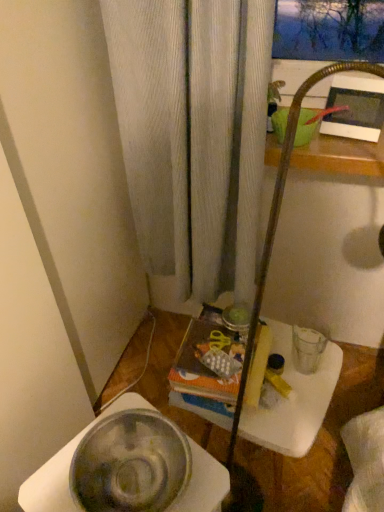
Question: Is green matte basin at upper right, which ranks as the 1th basin in back-to-front order, oriented away from clear plastic table at center?

Choices:
 (A) no
 (B) yes

Answer: (A)

Question: Could you tell me if green matte basin at upper right, the first basin from the right, is facing clear plastic table at center?

Choices:
 (A) yes
 (B) no

Answer: (B)

Question: Does green matte basin at upper right, which ranks as the 2th basin in front-to-back order, have a lesser height compared to clear plastic table at center?

Choices:
 (A) no
 (B) yes

Answer: (B)

Question: From the image's perspective, is green matte basin at upper right, placed as the 1th basin when sorted from top to bottom, over clear plastic table at center?

Choices:
 (A) yes
 (B) no

Answer: (A)

Question: Does green matte basin at upper right, which ranks as the 2th basin in front-to-back order, appear on the right side of clear plastic table at center?

Choices:
 (A) yes
 (B) no

Answer: (A)

Question: Is green matte basin at upper right, acting as the second basin starting from the bottom, taller than clear plastic table at center?

Choices:
 (A) yes
 (B) no

Answer: (B)

Question: Is clear plastic table at center behind metallic silver bowl at lower left, the 1th basin viewed from the left?

Choices:
 (A) yes
 (B) no

Answer: (A)

Question: Can you confirm if clear plastic table at center is shorter than metallic silver bowl at lower left, acting as the 1th basin starting from the front?

Choices:
 (A) yes
 (B) no

Answer: (B)

Question: Would you say clear plastic table at center is outside metallic silver bowl at lower left, which is the first basin from bottom to top?

Choices:
 (A) yes
 (B) no

Answer: (A)

Question: Considering the relative sizes of clear plastic table at center and metallic silver bowl at lower left, which appears as the 2th basin when viewed from the right, in the image provided, is clear plastic table at center bigger than metallic silver bowl at lower left, which appears as the 2th basin when viewed from the right,?

Choices:
 (A) yes
 (B) no

Answer: (A)

Question: Considering the relative positions of clear plastic table at center and metallic silver bowl at lower left, which is the 2th basin in back-to-front order, in the image provided, is clear plastic table at center to the left of metallic silver bowl at lower left, which is the 2th basin in back-to-front order, from the viewer's perspective?

Choices:
 (A) yes
 (B) no

Answer: (B)

Question: Is clear plastic table at center facing away from metallic silver bowl at lower left, which is the first basin from bottom to top?

Choices:
 (A) no
 (B) yes

Answer: (A)

Question: Could green matte basin at upper right, placed as the 1th basin when sorted from top to bottom, be considered to be inside metallic silver bowl at lower left, which appears as the 2th basin when viewed from the right?

Choices:
 (A) no
 (B) yes

Answer: (A)